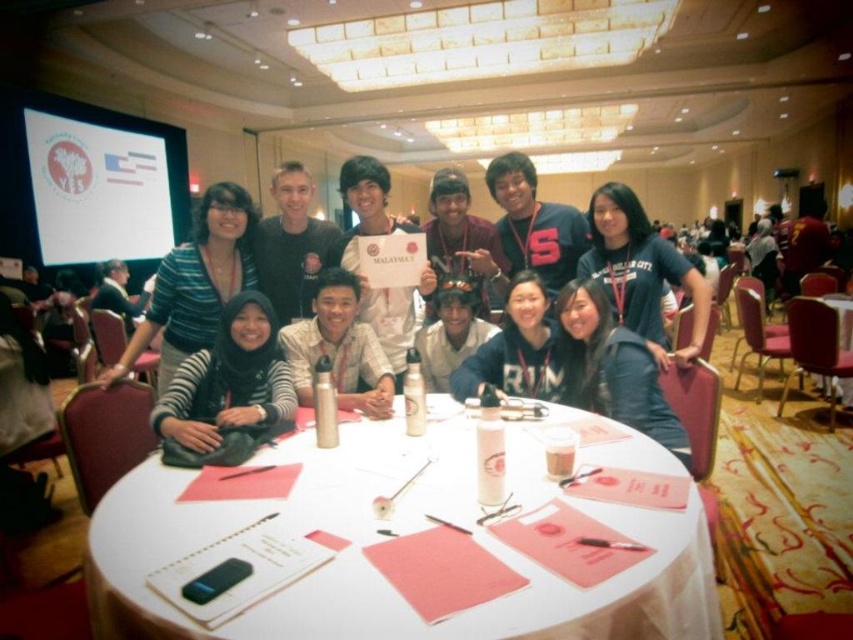
Which is above, black matte jacket at center or matte black shirt at center?

Positioned higher is matte black shirt at center.

Does black matte jacket at center lie in front of matte black shirt at center?

Yes, black matte jacket at center is in front of matte black shirt at center.

Does point (552, 380) lie behind point (273, 300)?

No, it is in front of (273, 300).

The width and height of the screenshot is (853, 640). Find the location of `black matte jacket at center`. black matte jacket at center is located at coordinates (515, 349).

Does striped fabric shirt at center appear on the right side of matte black shirt at center?

No, striped fabric shirt at center is not to the right of matte black shirt at center.

Between point (164, 374) and point (299, 205), which one is positioned in front?

Point (164, 374) is in front.

The height and width of the screenshot is (640, 853). Describe the element at coordinates (196, 282) in the screenshot. I see `striped fabric shirt at center` at that location.

Locate an element on the screen. This screenshot has height=640, width=853. striped fabric shirt at center is located at coordinates [x=196, y=282].

Between point (194, 273) and point (329, 348), which one is positioned behind?

The point (194, 273) is behind.

Is striped fabric shirt at center positioned before matte silver thermos at center?

That is False.

You are a GUI agent. You are given a task and a screenshot of the screen. Output one action in this format:
    pyautogui.click(x=<x>, y=<y>)
    Task: Click on the striped fabric shirt at center
    
    Given the screenshot: What is the action you would take?
    pyautogui.click(x=196, y=282)